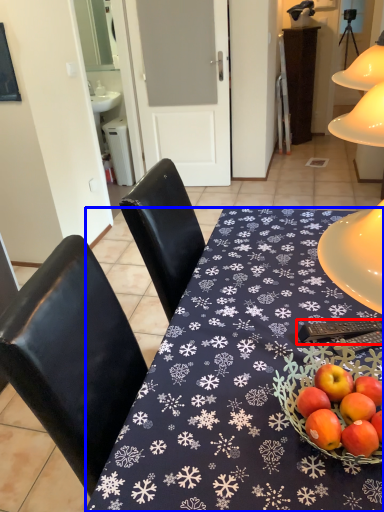
Question: Which object appears closest to the camera in this image, remote control (highlighted by a red box) or desk (highlighted by a blue box)?

Choices:
 (A) remote control
 (B) desk

Answer: (B)